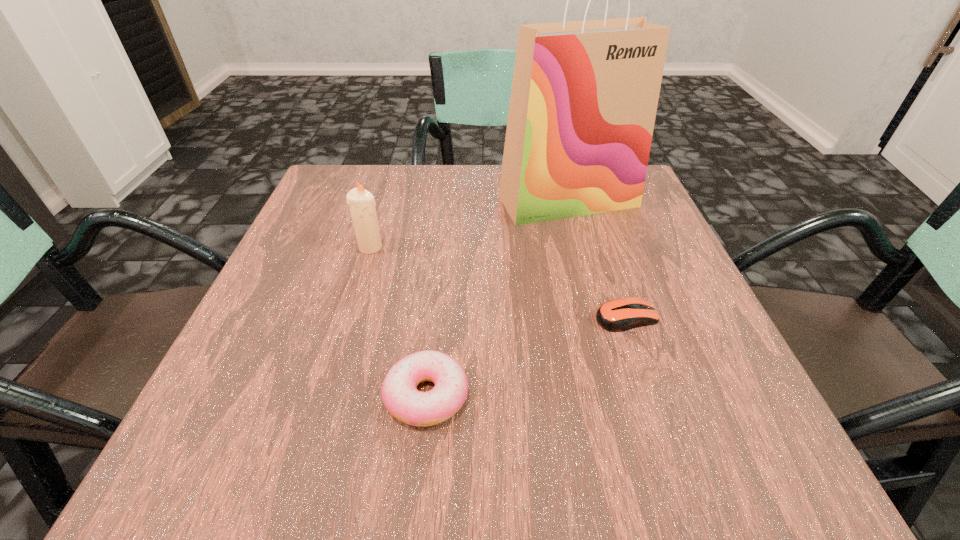
I want to click on vacant area between the second nearest object and the nearest object, so click(526, 356).

Locate an element on the screen. free space between the doughnut and the third nearest object is located at coordinates (398, 321).

Identify the location of unoccupied position between the second object from left to right and the third farthest object. (526, 356).

The width and height of the screenshot is (960, 540). I want to click on free space that is in between the shopping bag and the candle, so click(x=469, y=224).

The height and width of the screenshot is (540, 960). I want to click on empty space that is in between the computer mouse and the farthest object, so click(597, 259).

Point out which object is positioned as the third nearest to the shopping bag. Please provide its 2D coordinates. Your answer should be formatted as a tuple, i.e. [(x, y)], where the tuple contains the x and y coordinates of a point satisfying the conditions above.

[(399, 394)]

Select which object is the closest to the farthest object. Please provide its 2D coordinates. Your answer should be formatted as a tuple, i.e. [(x, y)], where the tuple contains the x and y coordinates of a point satisfying the conditions above.

[(618, 315)]

Where is `free region that satisfies the following two spatial constraints: 1. on the front side of the third tallest object; 2. on the left side of the second farthest object`? free region that satisfies the following two spatial constraints: 1. on the front side of the third tallest object; 2. on the left side of the second farthest object is located at coordinates (326, 395).